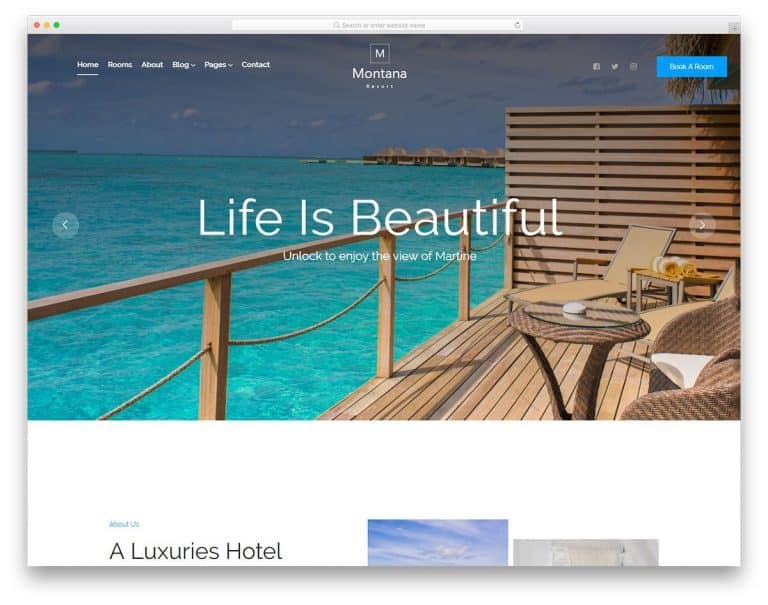
Where is `luxuries hotel`? luxuries hotel is located at coordinates (194, 551).